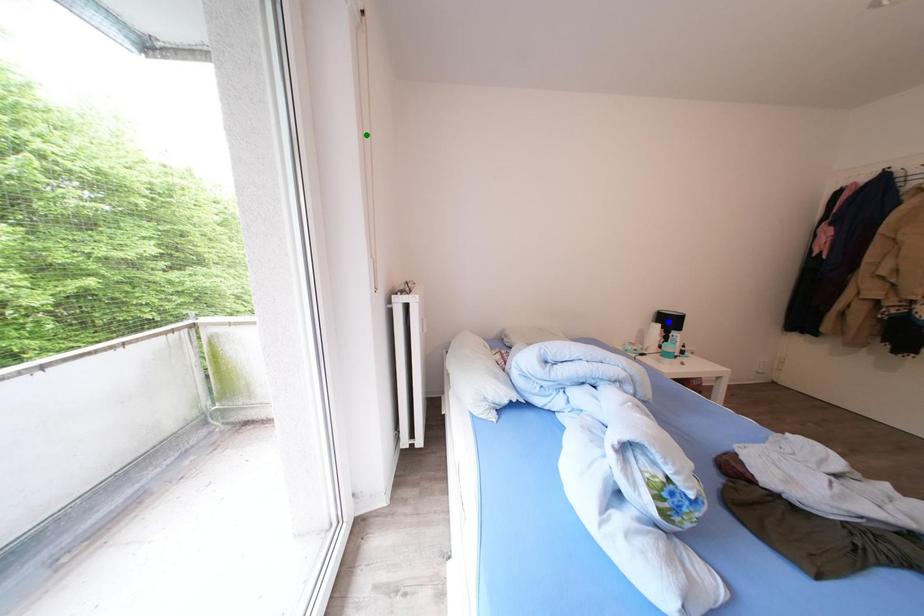
Order these from nearest to farthest:
1. red point
2. blue point
3. green point

green point < red point < blue point